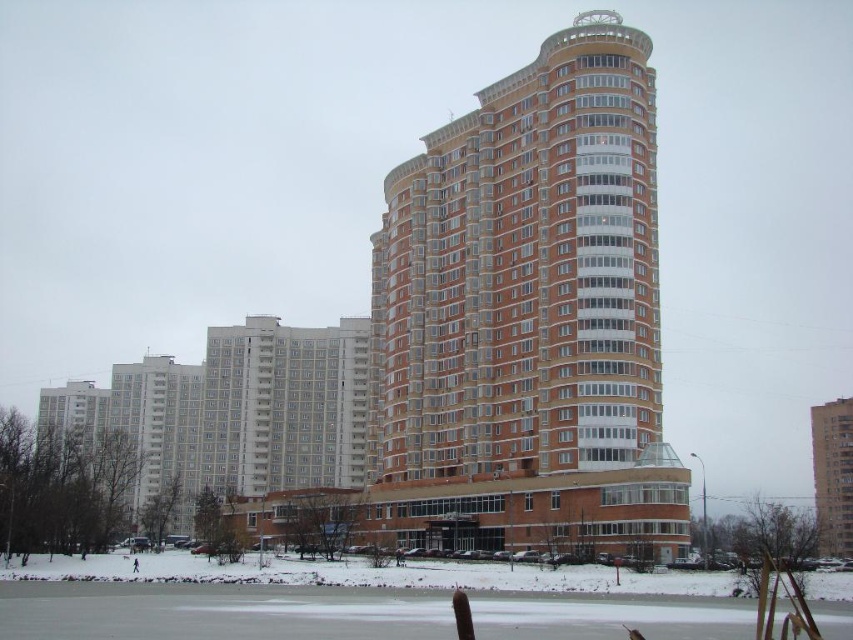
Is brown brick building at center positioned at the back of white smooth building at center?

No, it is in front of white smooth building at center.

Can you confirm if brown brick building at center is shorter than white smooth building at center?

In fact, brown brick building at center may be taller than white smooth building at center.

Does point (645, 292) come behind point (225, 364)?

That is False.

The image size is (853, 640). What are the coordinates of `brown brick building at center` in the screenshot? It's located at (526, 310).

Does white smooth building at center have a greater height compared to brick textured building at right?

Yes.

Is point (126, 500) less distant than point (844, 502)?

That is True.

Which is behind, point (112, 371) or point (842, 490)?

Positioned behind is point (112, 371).

Identify the location of white smooth building at center. (231, 413).

What do you see at coordinates (526, 310) in the screenshot? I see `brown brick building at center` at bounding box center [526, 310].

Can you confirm if brown brick building at center is positioned above brick textured building at right?

Yes.

This screenshot has width=853, height=640. Find the location of `brown brick building at center`. brown brick building at center is located at coordinates (526, 310).